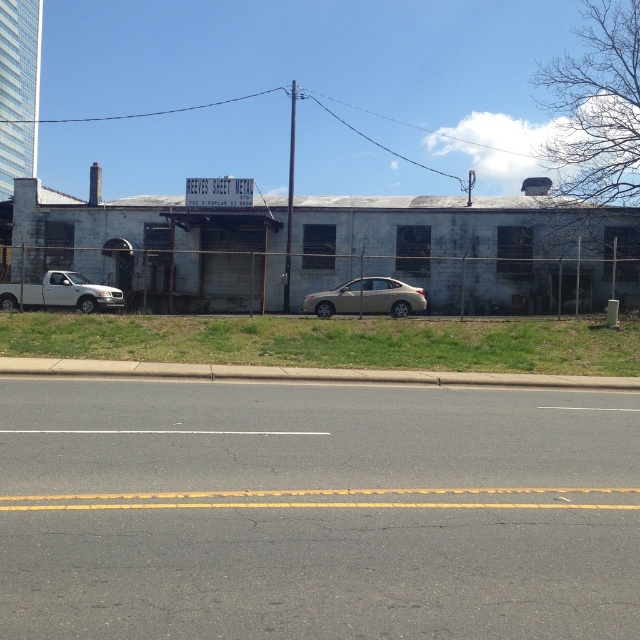
Is green grass at lower center above satin silver sedan at center?

Incorrect, green grass at lower center is not positioned above satin silver sedan at center.

Which is behind, point (486, 333) or point (420, 298)?

The point (420, 298) is more distant.

You are a GUI agent. You are given a task and a screenshot of the screen. Output one action in this format:
    pyautogui.click(x=<x>, y=<y>)
    Task: Click on the green grass at lower center
    The image size is (640, 640).
    Given the screenshot: What is the action you would take?
    [332, 340]

In the scene shown: Does green grass at lower center have a lesser width compared to white matte truck at left?

In fact, green grass at lower center might be wider than white matte truck at left.

Which is below, green grass at lower center or white matte truck at left?

green grass at lower center is lower down.

Identify the location of green grass at lower center. (332, 340).

In order to click on green grass at lower center in this screenshot , I will do `click(332, 340)`.

Does point (348, 288) come farther from viewer compared to point (70, 280)?

No.

Does satin silver sedan at center appear over white matte truck at left?

Actually, satin silver sedan at center is below white matte truck at left.

Identify the location of satin silver sedan at center. Image resolution: width=640 pixels, height=640 pixels. (365, 298).

This screenshot has width=640, height=640. I want to click on satin silver sedan at center, so click(365, 298).